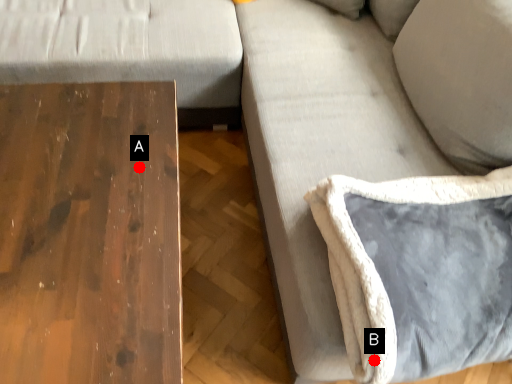
Question: Two points are circled on the image, labeled by A and B beside each circle. Which point is closer to the camera taking this photo?

Choices:
 (A) A is closer
 (B) B is closer

Answer: (B)